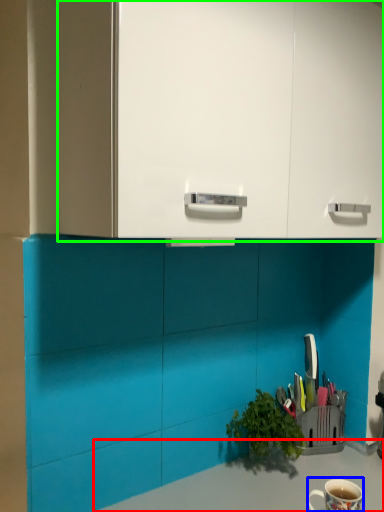
Question: Estimate the real-world distances between objects in this image. Which object is closer to counter top (highlighted by a red box), coffee cup (highlighted by a blue box) or dresser (highlighted by a green box)?

Choices:
 (A) coffee cup
 (B) dresser

Answer: (A)